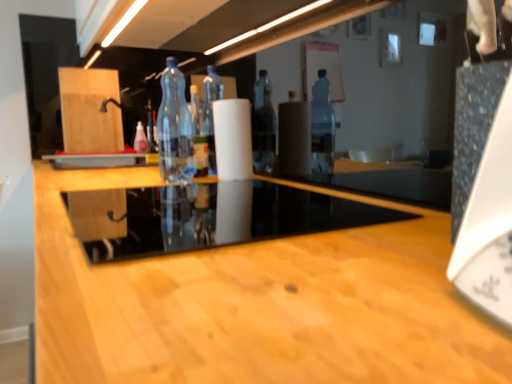
Question: From the image's perspective, is transparent plastic bottle at center, placed as the second bottle when sorted from left to right, located beneath white matte paper towel at center?

Choices:
 (A) no
 (B) yes

Answer: (A)

Question: From a real-world perspective, is transparent plastic bottle at center, the 1th bottle when ordered from right to left, on top of white matte paper towel at center?

Choices:
 (A) yes
 (B) no

Answer: (A)

Question: Is transparent plastic bottle at center, the 1th bottle when ordered from right to left, completely or partially outside of white matte paper towel at center?

Choices:
 (A) no
 (B) yes

Answer: (B)

Question: Considering the relative positions of transparent plastic bottle at center, which appears as the 1th bottle when viewed from the front, and white matte paper towel at center in the image provided, is transparent plastic bottle at center, which appears as the 1th bottle when viewed from the front, to the right of white matte paper towel at center from the viewer's perspective?

Choices:
 (A) yes
 (B) no

Answer: (B)

Question: Is transparent plastic bottle at center, which ranks as the 2th bottle in back-to-front order, next to white matte paper towel at center?

Choices:
 (A) yes
 (B) no

Answer: (B)

Question: Can you confirm if transparent plastic bottle at center, which ranks as the 2th bottle in back-to-front order, is wider than white matte paper towel at center?

Choices:
 (A) yes
 (B) no

Answer: (B)

Question: Considering the relative sizes of transparent glass table at center and pink plastic bottle at center, which is the second bottle from front to back, in the image provided, is transparent glass table at center taller than pink plastic bottle at center, which is the second bottle from front to back,?

Choices:
 (A) yes
 (B) no

Answer: (B)

Question: Does transparent glass table at center turn towards pink plastic bottle at center, the first bottle from the back?

Choices:
 (A) yes
 (B) no

Answer: (B)

Question: Considering the relative sizes of transparent glass table at center and pink plastic bottle at center, which is the second bottle from front to back, in the image provided, is transparent glass table at center shorter than pink plastic bottle at center, which is the second bottle from front to back,?

Choices:
 (A) no
 (B) yes

Answer: (B)

Question: Can you confirm if transparent glass table at center is thinner than pink plastic bottle at center, the first bottle from the left?

Choices:
 (A) no
 (B) yes

Answer: (A)

Question: Is transparent glass table at center far from pink plastic bottle at center, the first bottle from the left?

Choices:
 (A) yes
 (B) no

Answer: (B)

Question: From the image's perspective, is transparent glass table at center under pink plastic bottle at center, marked as the 2th bottle in a right-to-left arrangement?

Choices:
 (A) yes
 (B) no

Answer: (A)

Question: Considering the relative positions of transparent glass table at center and transparent plastic bottle at center, placed as the second bottle when sorted from left to right, in the image provided, is transparent glass table at center in front of transparent plastic bottle at center, placed as the second bottle when sorted from left to right,?

Choices:
 (A) yes
 (B) no

Answer: (A)